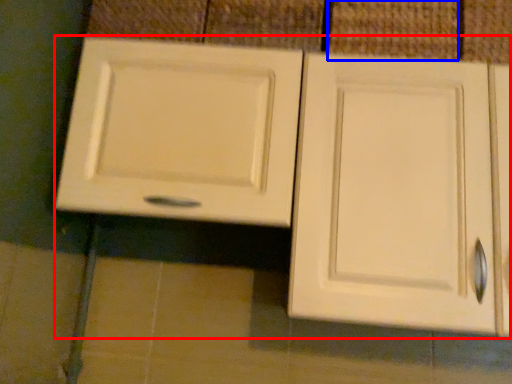
Question: Which object is closer to the camera taking this photo, cabinetry (highlighted by a red box) or tile (highlighted by a blue box)?

Choices:
 (A) cabinetry
 (B) tile

Answer: (A)